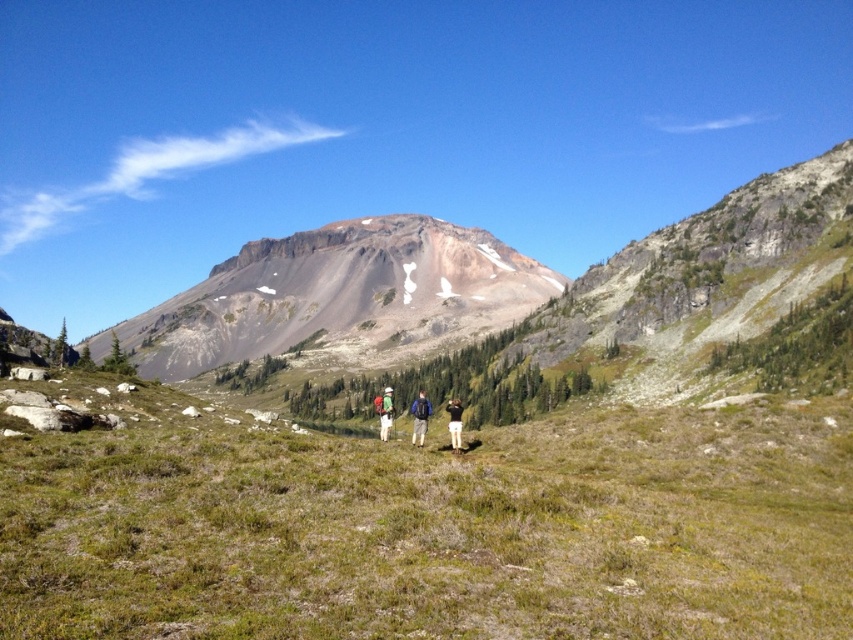
Is point (386, 518) positioned before point (426, 252)?

Yes.

Is green grassy field at center bigger than rustic brown mountain at center?

No.

Is point (480, 602) closer to viewer compared to point (444, 244)?

That is True.

Where is `green grassy field at center`? green grassy field at center is located at coordinates (436, 531).

Does green grassy field at center appear on the left side of camouflage fabric backpacks at center?

In fact, green grassy field at center is to the right of camouflage fabric backpacks at center.

Does green grassy field at center appear over camouflage fabric backpacks at center?

Yes.

The width and height of the screenshot is (853, 640). I want to click on green grassy field at center, so click(436, 531).

Based on the photo, does camouflage fabric backpacks at center appear on the left side of matte blue backpack at center?

In fact, camouflage fabric backpacks at center is to the right of matte blue backpack at center.

Is camouflage fabric backpacks at center taller than matte blue backpack at center?

Yes, camouflage fabric backpacks at center is taller than matte blue backpack at center.

You are a GUI agent. You are given a task and a screenshot of the screen. Output one action in this format:
    pyautogui.click(x=<x>, y=<y>)
    Task: Click on the camouflage fabric backpacks at center
    
    Given the screenshot: What is the action you would take?
    pyautogui.click(x=419, y=417)